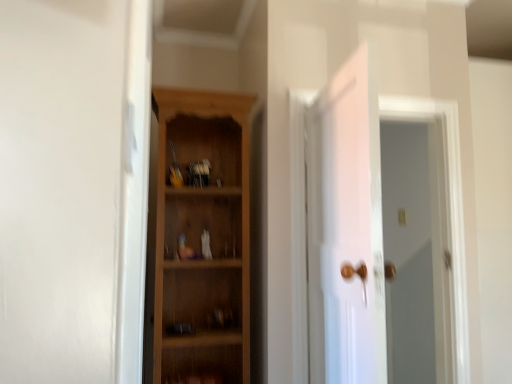
Question: Is white glossy door at center to the right of white glossy door at upper right from the viewer's perspective?

Choices:
 (A) no
 (B) yes

Answer: (A)

Question: From the image's perspective, is white glossy door at center beneath white glossy door at upper right?

Choices:
 (A) yes
 (B) no

Answer: (B)

Question: Does white glossy door at center have a lesser width compared to white glossy door at upper right?

Choices:
 (A) no
 (B) yes

Answer: (A)

Question: Is white glossy door at center completely or partially outside of white glossy door at upper right?

Choices:
 (A) yes
 (B) no

Answer: (A)

Question: Considering the relative sizes of white glossy door at center and white glossy door at upper right in the image provided, is white glossy door at center shorter than white glossy door at upper right?

Choices:
 (A) no
 (B) yes

Answer: (B)

Question: From a real-world perspective, is white glossy door at upper right physically located above or below wooden cabinet at center?

Choices:
 (A) below
 (B) above

Answer: (A)

Question: From the image's perspective, relative to wooden cabinet at center, is white glossy door at upper right above or below?

Choices:
 (A) below
 (B) above

Answer: (A)

Question: Considering the positions of white glossy door at upper right and wooden cabinet at center in the image, is white glossy door at upper right taller or shorter than wooden cabinet at center?

Choices:
 (A) short
 (B) tall

Answer: (A)

Question: Visually, is white glossy door at upper right positioned to the left or to the right of wooden cabinet at center?

Choices:
 (A) left
 (B) right

Answer: (B)

Question: Considering their positions, is wooden cabinet at center located in front of or behind white glossy door at center?

Choices:
 (A) front
 (B) behind

Answer: (B)

Question: Is wooden cabinet at center to the left or to the right of white glossy door at center in the image?

Choices:
 (A) right
 (B) left

Answer: (B)

Question: Would you say wooden cabinet at center is inside or outside white glossy door at center?

Choices:
 (A) outside
 (B) inside

Answer: (A)

Question: From the image's perspective, is wooden cabinet at center located above or below white glossy door at center?

Choices:
 (A) above
 (B) below

Answer: (A)

Question: Is white glossy door at center spatially inside white glossy door at upper right, or outside of it?

Choices:
 (A) outside
 (B) inside

Answer: (A)

Question: From the image's perspective, is white glossy door at center above or below white glossy door at upper right?

Choices:
 (A) above
 (B) below

Answer: (A)